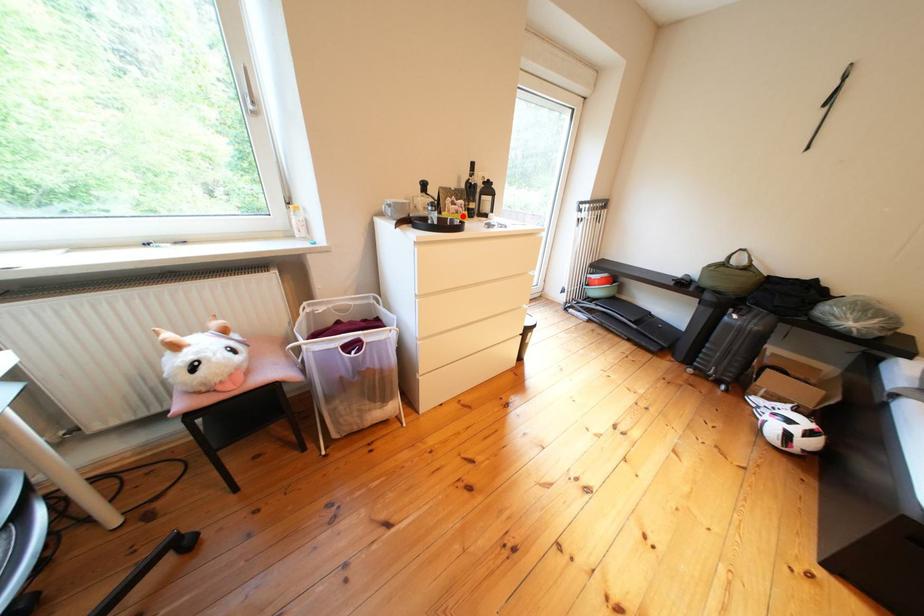
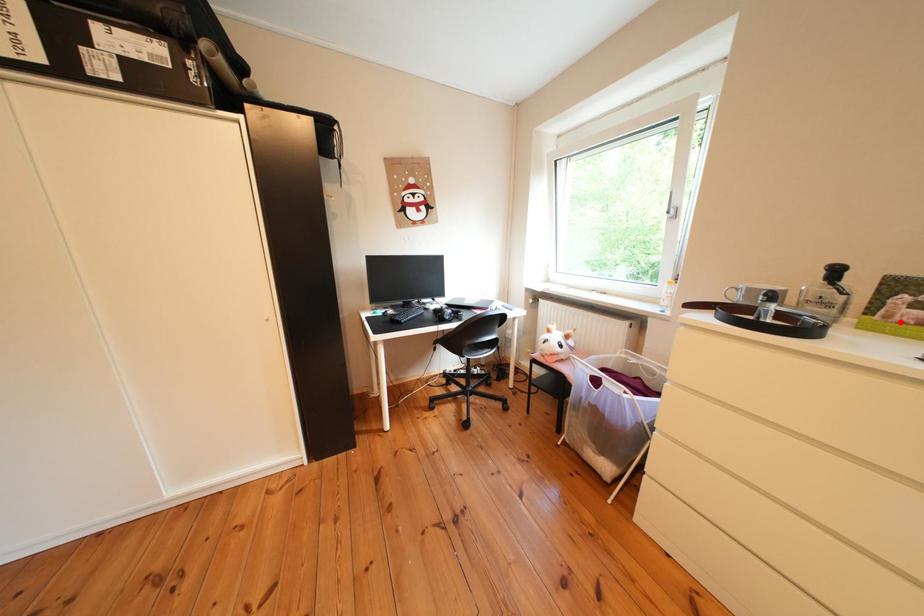
I am providing you with two images of the same scene from different viewpoints. A red point is marked on the first image and another point is marked on the second image. Do the highlighted points in image1 and image2 indicate the same real-world spot?

Yes